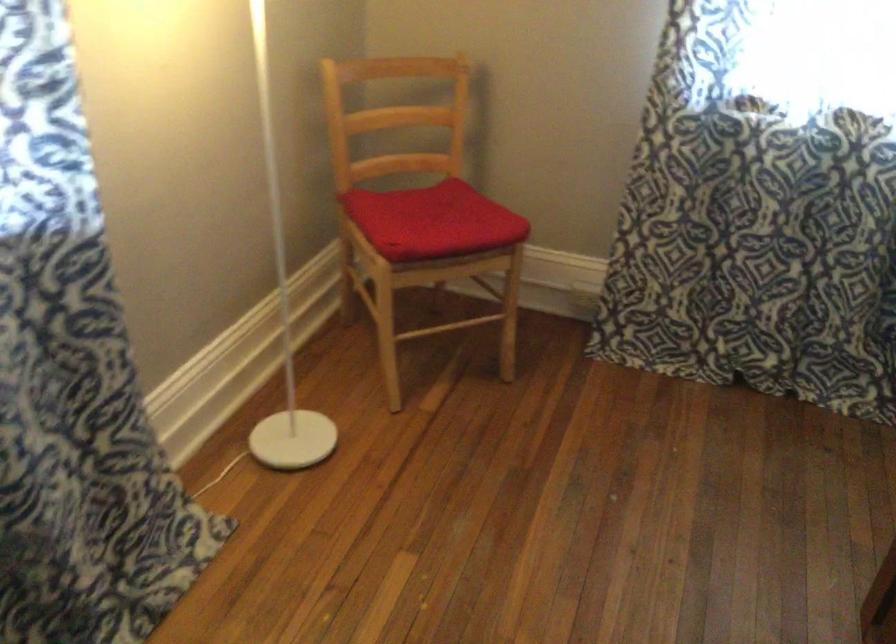
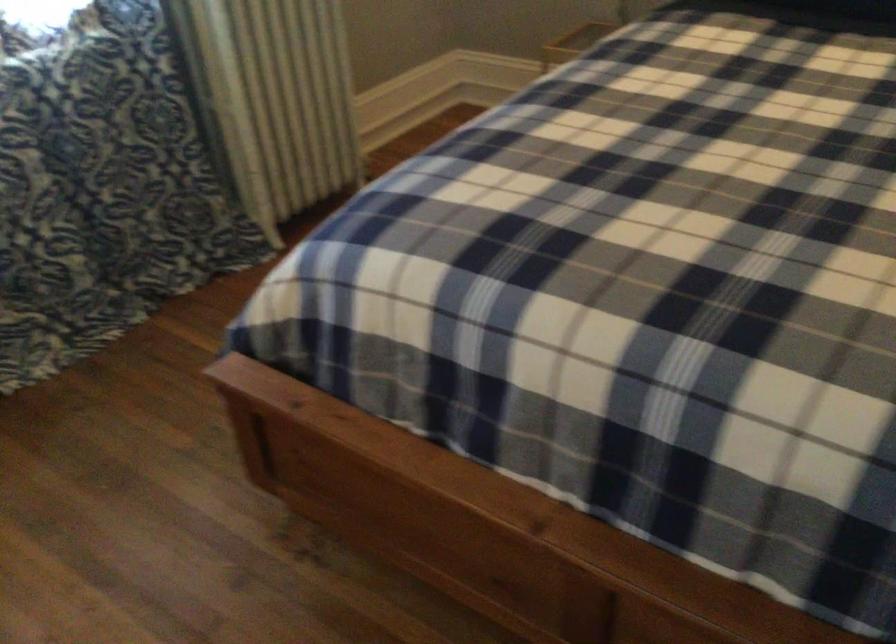
The images are taken continuously from a first-person perspective. In which direction is your viewpoint rotating?

The rotation direction of the camera is right-down.